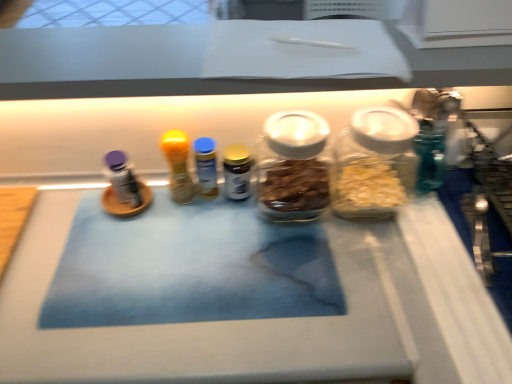
I want to click on free space to the right of blue plastic bottle at center, the second bottle viewed from the left, so click(300, 233).